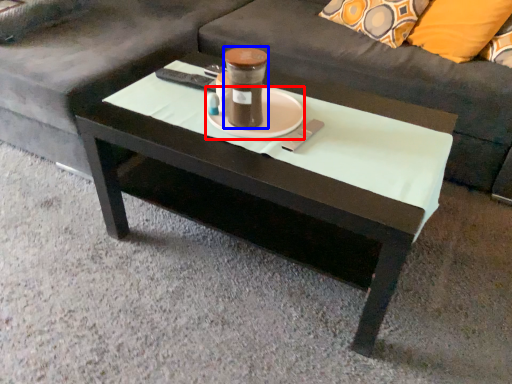
Question: Among these objects, which one is farthest to the camera, saucer (highlighted by a red box) or beverage (highlighted by a blue box)?

Choices:
 (A) saucer
 (B) beverage

Answer: (A)